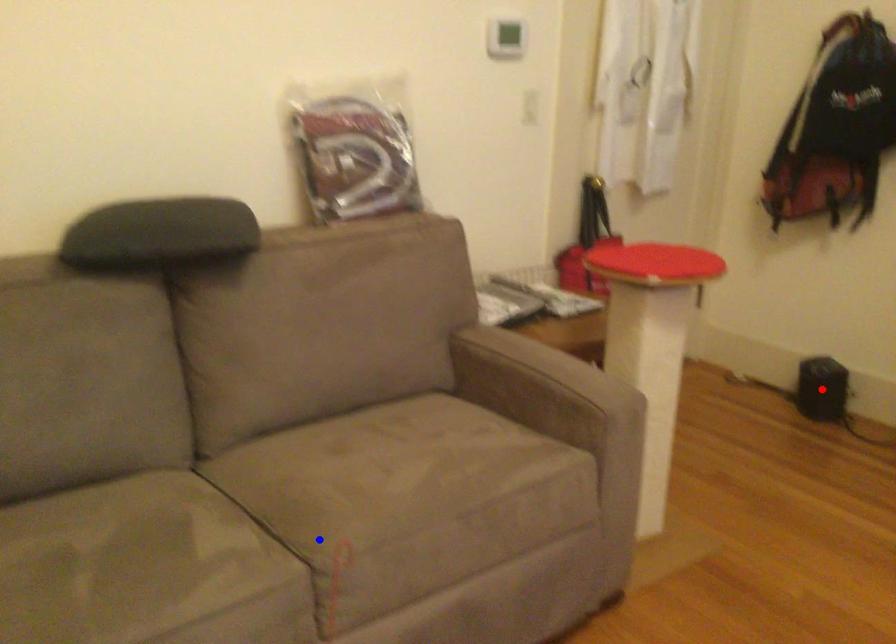
Question: Two points are marked on the image. Which point is closer to the camera?

Choices:
 (A) Blue point is closer.
 (B) Red point is closer.

Answer: (A)